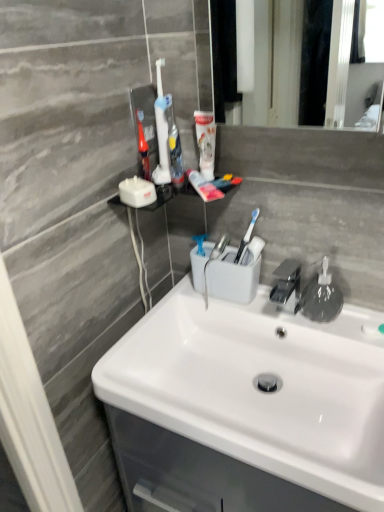
Image resolution: width=384 pixels, height=512 pixels. What do you see at coordinates (174, 146) in the screenshot?
I see `white plastic toothbrush at upper center, placed as the third toothbrush when sorted from left to right` at bounding box center [174, 146].

Describe the element at coordinates (143, 147) in the screenshot. I see `translucent plastic toothbrush at upper center, which ranks as the 3th toothbrush in right-to-left order` at that location.

Image resolution: width=384 pixels, height=512 pixels. In order to click on white glossy toothpaste tube at upper center in this screenshot , I will do `click(205, 142)`.

Is white plastic toothbrush at upper center, placed as the third toothbrush when sorted from left to right, wider or thinner than white glossy sink at center?

Clearly, white plastic toothbrush at upper center, placed as the third toothbrush when sorted from left to right, has less width compared to white glossy sink at center.

Between white plastic toothbrush at upper center, the first toothbrush when ordered from right to left, and white glossy sink at center, which one appears on the right side from the viewer's perspective?

From the viewer's perspective, white glossy sink at center appears more on the right side.

Based on the photo, is white plastic toothbrush at upper center, the first toothbrush when ordered from right to left, oriented away from white glossy sink at center?

white plastic toothbrush at upper center, the first toothbrush when ordered from right to left, does not have its back to white glossy sink at center.

Where is `toothbrush that is the 2nd one when counting upward from the white glossy sink at center (from the image's perspective)`? This screenshot has height=512, width=384. toothbrush that is the 2nd one when counting upward from the white glossy sink at center (from the image's perspective) is located at coordinates (174, 146).

Is translucent plastic toothbrush at upper center, the 1th toothbrush when ordered from left to right, further to the viewer compared to white plastic toothbrush at upper center, the first toothbrush when ordered from right to left?

Yes, translucent plastic toothbrush at upper center, the 1th toothbrush when ordered from left to right, is further from the viewer.

Consider the image. Which is correct: translucent plastic toothbrush at upper center, which ranks as the 3th toothbrush in right-to-left order, is inside white plastic toothbrush at upper center, the first toothbrush when ordered from right to left, or outside of it?

translucent plastic toothbrush at upper center, which ranks as the 3th toothbrush in right-to-left order, lies outside white plastic toothbrush at upper center, the first toothbrush when ordered from right to left.

Who is bigger, translucent plastic toothbrush at upper center, the 1th toothbrush when ordered from left to right, or white plastic toothbrush at upper center, the first toothbrush when ordered from right to left?

Bigger between the two is white plastic toothbrush at upper center, the first toothbrush when ordered from right to left.

How many degrees apart are the facing directions of translucent plastic toothbrush at upper center, which ranks as the 3th toothbrush in right-to-left order, and white plastic toothbrush at upper center, the first toothbrush when ordered from right to left?

8.08 degrees separate the facing orientations of translucent plastic toothbrush at upper center, which ranks as the 3th toothbrush in right-to-left order, and white plastic toothbrush at upper center, the first toothbrush when ordered from right to left.

From the image's perspective, does white plastic toothbrush at upper center, placed as the third toothbrush when sorted from left to right, appear higher than transparent plastic soap dispenser at right?

Yes, from the image's perspective, white plastic toothbrush at upper center, placed as the third toothbrush when sorted from left to right, is above transparent plastic soap dispenser at right.

Considering the relative sizes of white plastic toothbrush at upper center, placed as the third toothbrush when sorted from left to right, and transparent plastic soap dispenser at right in the image provided, is white plastic toothbrush at upper center, placed as the third toothbrush when sorted from left to right, wider than transparent plastic soap dispenser at right?

No, white plastic toothbrush at upper center, placed as the third toothbrush when sorted from left to right, is not wider than transparent plastic soap dispenser at right.

Considering the relative positions of white plastic toothbrush at upper center, the first toothbrush when ordered from right to left, and transparent plastic soap dispenser at right in the image provided, is white plastic toothbrush at upper center, the first toothbrush when ordered from right to left, in front of transparent plastic soap dispenser at right?

No, white plastic toothbrush at upper center, the first toothbrush when ordered from right to left, is further to the viewer.

From a real-world perspective, which is physically above, transparent plastic soap dispenser at right or translucent plastic toothbrush at upper center, which ranks as the 3th toothbrush in right-to-left order?

From a 3D spatial view, translucent plastic toothbrush at upper center, which ranks as the 3th toothbrush in right-to-left order, is above.

Consider the image. Is transparent plastic soap dispenser at right facing away from translucent plastic toothbrush at upper center, the 1th toothbrush when ordered from left to right?

That's not correct — transparent plastic soap dispenser at right is not looking away from translucent plastic toothbrush at upper center, the 1th toothbrush when ordered from left to right.

The height and width of the screenshot is (512, 384). Find the location of `the 2nd toothbrush behind the transparent plastic soap dispenser at right`. the 2nd toothbrush behind the transparent plastic soap dispenser at right is located at coordinates (143, 147).

Would you say transparent plastic soap dispenser at right is a long distance from translucent plastic toothbrush at upper center, which ranks as the 3th toothbrush in right-to-left order?

No, there isn't a large distance between transparent plastic soap dispenser at right and translucent plastic toothbrush at upper center, which ranks as the 3th toothbrush in right-to-left order.

From a real-world perspective, is white glossy sink at center above or below white plastic toothbrush at upper center, placed as the third toothbrush when sorted from left to right?

From a real-world perspective, white glossy sink at center is physically below white plastic toothbrush at upper center, placed as the third toothbrush when sorted from left to right.

Is white glossy sink at center wider or thinner than white plastic toothbrush at upper center, placed as the third toothbrush when sorted from left to right?

Clearly, white glossy sink at center has more width compared to white plastic toothbrush at upper center, placed as the third toothbrush when sorted from left to right.

Considering the positions of point (232, 402) and point (170, 142), is point (232, 402) closer or farther from the camera than point (170, 142)?

Point (232, 402).

From the image's perspective, is white glossy sink at center over white plastic toothbrush at upper center, placed as the third toothbrush when sorted from left to right?

No, from the image's perspective, white glossy sink at center is not over white plastic toothbrush at upper center, placed as the third toothbrush when sorted from left to right.

Can you confirm if white plastic toothbrush at upper center, the second toothbrush from the left, is positioned to the left of transparent plastic soap dispenser at right?

Indeed, white plastic toothbrush at upper center, the second toothbrush from the left, is positioned on the left side of transparent plastic soap dispenser at right.

From their relative heights in the image, would you say white plastic toothbrush at upper center, the second toothbrush from the left, is taller or shorter than transparent plastic soap dispenser at right?

Clearly, white plastic toothbrush at upper center, the second toothbrush from the left, is taller compared to transparent plastic soap dispenser at right.

Is white plastic toothbrush at upper center, the second toothbrush from the left, not within transparent plastic soap dispenser at right?

Yes, white plastic toothbrush at upper center, the second toothbrush from the left, is not within transparent plastic soap dispenser at right.

Would you say white plastic toothbrush at upper center, the second toothbrush positioned from the right, contains white glossy sink at center?

No, white glossy sink at center is not surrounded by white plastic toothbrush at upper center, the second toothbrush positioned from the right.

From the image's perspective, which is below, white plastic toothbrush at upper center, the second toothbrush from the left, or white glossy sink at center?

white glossy sink at center is shown below in the image.

Which object is closer to the camera, white plastic toothbrush at upper center, the second toothbrush from the left, or white glossy sink at center?

white glossy sink at center.

Locate an element on the screen. The width and height of the screenshot is (384, 512). the 2nd toothbrush behind the white glossy sink at center is located at coordinates (174, 146).

Where is `toothbrush below the white plastic toothbrush at upper center, the first toothbrush when ordered from right to left (from the image's perspective)`? toothbrush below the white plastic toothbrush at upper center, the first toothbrush when ordered from right to left (from the image's perspective) is located at coordinates (143, 147).

Considering their positions, is translucent plastic toothbrush at upper center, which ranks as the 3th toothbrush in right-to-left order, positioned further to white plastic toothbrush at upper center, placed as the third toothbrush when sorted from left to right, than white glossy toothpaste tube at upper center?

The object further to white plastic toothbrush at upper center, placed as the third toothbrush when sorted from left to right, is translucent plastic toothbrush at upper center, which ranks as the 3th toothbrush in right-to-left order.

In the scene shown: Estimate the real-world distances between objects in this image. Which object is closer to transparent plastic soap dispenser at right, white plastic toothbrush at upper center, placed as the third toothbrush when sorted from left to right, or white glossy sink at center?

Based on the image, white glossy sink at center appears to be nearer to transparent plastic soap dispenser at right.

When comparing their distances from translucent plastic toothbrush at upper center, which ranks as the 3th toothbrush in right-to-left order, does white plastic toothbrush at upper center, placed as the third toothbrush when sorted from left to right, or transparent plastic soap dispenser at right seem closer?

white plastic toothbrush at upper center, placed as the third toothbrush when sorted from left to right, is positioned closer to the anchor translucent plastic toothbrush at upper center, which ranks as the 3th toothbrush in right-to-left order.

Based on their spatial positions, is white glossy toothpaste tube at upper center or white plastic toothbrush at upper center, placed as the third toothbrush when sorted from left to right, closer to transparent plastic soap dispenser at right?

The object closer to transparent plastic soap dispenser at right is white glossy toothpaste tube at upper center.

Which object lies further to the anchor point translucent plastic toothbrush at upper center, the 1th toothbrush when ordered from left to right, white plastic toothbrush at upper center, the second toothbrush from the left, or white plastic toothbrush at upper center, the first toothbrush when ordered from right to left?

Among the two, white plastic toothbrush at upper center, the first toothbrush when ordered from right to left, is located further to translucent plastic toothbrush at upper center, the 1th toothbrush when ordered from left to right.

From the image, which object appears to be nearer to white glossy toothpaste tube at upper center, white plastic toothbrush at upper center, the second toothbrush positioned from the right, or translucent plastic toothbrush at upper center, the 1th toothbrush when ordered from left to right?

The object closer to white glossy toothpaste tube at upper center is white plastic toothbrush at upper center, the second toothbrush positioned from the right.

Considering their positions, is white plastic toothbrush at upper center, placed as the third toothbrush when sorted from left to right, positioned closer to white glossy sink at center than transparent plastic soap dispenser at right?

Based on the image, transparent plastic soap dispenser at right appears to be nearer to white glossy sink at center.

Considering their positions, is white plastic toothbrush at upper center, the second toothbrush positioned from the right, positioned further to white glossy sink at center than transparent plastic soap dispenser at right?

The object further to white glossy sink at center is white plastic toothbrush at upper center, the second toothbrush positioned from the right.

The height and width of the screenshot is (512, 384). I want to click on mouthwash that lies between white plastic toothbrush at upper center, the second toothbrush from the left, and white glossy sink at center from top to bottom, so click(x=205, y=142).

Where is `toothbrush located between translucent plastic toothbrush at upper center, which ranks as the 3th toothbrush in right-to-left order, and white plastic toothbrush at upper center, the first toothbrush when ordered from right to left, in the left-right direction`? This screenshot has width=384, height=512. toothbrush located between translucent plastic toothbrush at upper center, which ranks as the 3th toothbrush in right-to-left order, and white plastic toothbrush at upper center, the first toothbrush when ordered from right to left, in the left-right direction is located at coordinates (161, 132).

Find the location of `mouthwash between white plastic toothbrush at upper center, the second toothbrush from the left, and transparent plastic soap dispenser at right, in the vertical direction`. mouthwash between white plastic toothbrush at upper center, the second toothbrush from the left, and transparent plastic soap dispenser at right, in the vertical direction is located at coordinates (205, 142).

You are a GUI agent. You are given a task and a screenshot of the screen. Output one action in this format:
    pyautogui.click(x=<x>, y=<y>)
    Task: Click on the soap dispenser that lies between white plastic toothbrush at upper center, placed as the third toothbrush when sorted from left to right, and white glossy sink at center from top to bottom
    
    Given the screenshot: What is the action you would take?
    pyautogui.click(x=321, y=297)